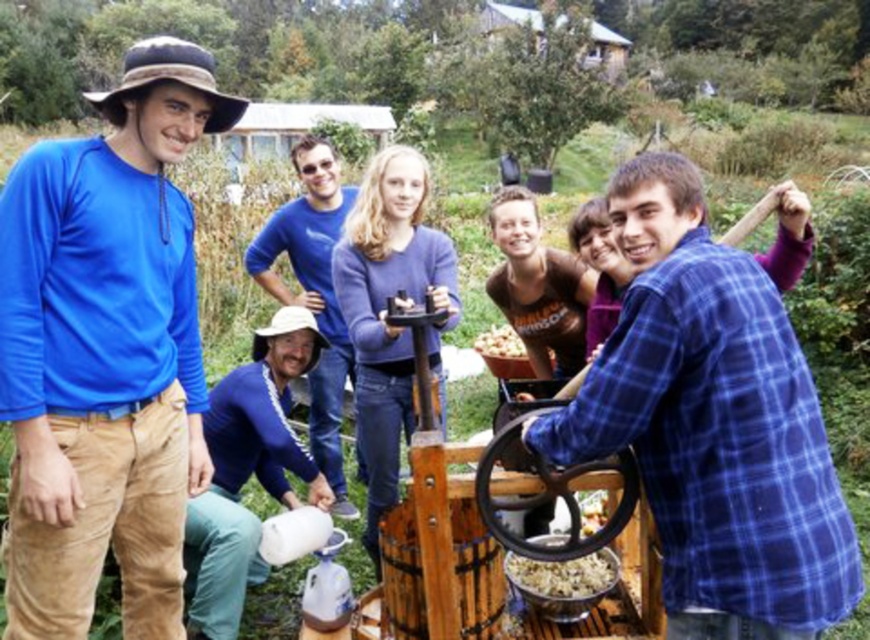
Looking at this image, who is lower down, blue plaid shirt at center or smooth brown nuts at center?

blue plaid shirt at center is below.

From the picture: Between blue plaid shirt at center and smooth brown nuts at center, which one appears on the right side from the viewer's perspective?

blue plaid shirt at center is more to the right.

Is point (676, 627) closer to camera compared to point (512, 339)?

Yes, point (676, 627) is closer to viewer.

Locate an element on the screen. blue plaid shirt at center is located at coordinates (713, 424).

Between point (306, 218) and point (553, 586), which one is positioned behind?

Point (306, 218)

Who is lower down, blue cotton shirt at center or crumbly brown food at center?

Positioned lower is crumbly brown food at center.

Which is in front, point (338, 412) or point (610, 566)?

Point (610, 566) is more forward.

This screenshot has width=870, height=640. Identify the location of blue cotton shirt at center. (313, 292).

Does crumbly brown food at center have a greater height compared to smooth brown nuts at center?

In fact, crumbly brown food at center may be shorter than smooth brown nuts at center.

Does crumbly brown food at center appear under smooth brown nuts at center?

Indeed, crumbly brown food at center is positioned under smooth brown nuts at center.

Is point (530, 560) positioned behind point (485, 340)?

That is False.

Identify the location of crumbly brown food at center. The height and width of the screenshot is (640, 870). coord(563,576).